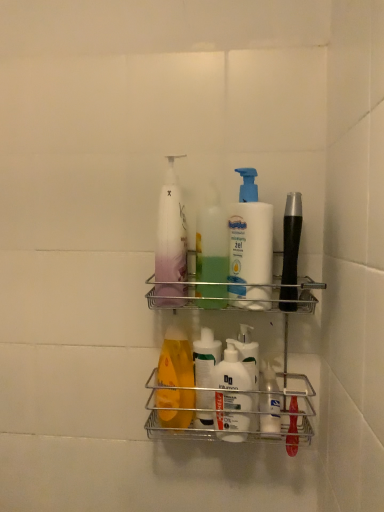
The height and width of the screenshot is (512, 384). I want to click on translucent plastic pump bottle at center, which is the first cleaning product in left-to-right order, so click(170, 241).

Find the location of `metallic silver shelf at center`. metallic silver shelf at center is located at coordinates (225, 394).

In the image, is white matte lotion at center, the 1th cleaning product in the right-to-left sequence, positioned in front of or behind translucent plastic pump bottle at center, which is the first cleaning product in left-to-right order?

In the image, white matte lotion at center, the 1th cleaning product in the right-to-left sequence, appears in front of translucent plastic pump bottle at center, which is the first cleaning product in left-to-right order.

From the image's perspective, is white matte lotion at center, the 1th cleaning product in the right-to-left sequence, located above or below translucent plastic pump bottle at center, which is the third cleaning product from right to left?

Based on their image positions, white matte lotion at center, the 1th cleaning product in the right-to-left sequence, is located beneath translucent plastic pump bottle at center, which is the third cleaning product from right to left.

Can you confirm if white matte lotion at center, which is the 3th cleaning product in left-to-right order, is bigger than translucent plastic pump bottle at center, which is the third cleaning product from right to left?

No, white matte lotion at center, which is the 3th cleaning product in left-to-right order, is not bigger than translucent plastic pump bottle at center, which is the third cleaning product from right to left.

Consider the image. Is white matte lotion at center, the 1th cleaning product in the right-to-left sequence, in contact with translucent plastic pump bottle at center, which is the third cleaning product from right to left?

No.

Is translucent plastic pump bottle at center, which is the first cleaning product in left-to-right order, behind translucent plastic bottle at center, the second cleaning product in the left-to-right sequence?

Yes, translucent plastic pump bottle at center, which is the first cleaning product in left-to-right order, is further from the viewer.

In terms of size, does translucent plastic pump bottle at center, which is the third cleaning product from right to left, appear bigger or smaller than translucent plastic bottle at center, positioned as the second cleaning product in right-to-left order?

translucent plastic pump bottle at center, which is the third cleaning product from right to left, is bigger than translucent plastic bottle at center, positioned as the second cleaning product in right-to-left order.

From a real-world perspective, relative to translucent plastic bottle at center, the second cleaning product in the left-to-right sequence, is translucent plastic pump bottle at center, which is the first cleaning product in left-to-right order, vertically above or below?

Clearly, from a real-world perspective, translucent plastic pump bottle at center, which is the first cleaning product in left-to-right order, is above translucent plastic bottle at center, the second cleaning product in the left-to-right sequence.

Could you tell me if translucent plastic pump bottle at center, which is the first cleaning product in left-to-right order, is turned towards translucent plastic bottle at center, positioned as the second cleaning product in right-to-left order?

No, translucent plastic pump bottle at center, which is the first cleaning product in left-to-right order, does not turn towards translucent plastic bottle at center, positioned as the second cleaning product in right-to-left order.

Can you confirm if translucent plastic pump bottle at center, which is the first cleaning product in left-to-right order, is smaller than metallic silver shelf at center?

Yes.

From the image's perspective, is translucent plastic pump bottle at center, which is the third cleaning product from right to left, on top of metallic silver shelf at center?

Yes, from the image's perspective, translucent plastic pump bottle at center, which is the third cleaning product from right to left, is over metallic silver shelf at center.

Find the location of a particular element. Image resolution: width=384 pixels, height=512 pixels. shelf in front of the translucent plastic pump bottle at center, which is the third cleaning product from right to left is located at coordinates (225, 394).

The height and width of the screenshot is (512, 384). In order to click on cleaning product in front of the translucent plastic bottle at center, positioned as the second cleaning product in right-to-left order in this screenshot , I will do `click(250, 242)`.

Which object is thinner, white matte lotion at center, which is the 3th cleaning product in left-to-right order, or translucent plastic bottle at center, positioned as the second cleaning product in right-to-left order?

With smaller width is white matte lotion at center, which is the 3th cleaning product in left-to-right order.

Considering the sizes of objects white matte lotion at center, the 1th cleaning product in the right-to-left sequence, and translucent plastic bottle at center, the second cleaning product in the left-to-right sequence, in the image provided, who is taller, white matte lotion at center, the 1th cleaning product in the right-to-left sequence, or translucent plastic bottle at center, the second cleaning product in the left-to-right sequence,?

Standing taller between the two is translucent plastic bottle at center, the second cleaning product in the left-to-right sequence.

Is white matte lotion at center, the 1th cleaning product in the right-to-left sequence, aimed at translucent plastic bottle at center, positioned as the second cleaning product in right-to-left order?

No, white matte lotion at center, the 1th cleaning product in the right-to-left sequence, is not turned towards translucent plastic bottle at center, positioned as the second cleaning product in right-to-left order.

From the image's perspective, is translucent plastic bottle at center, positioned as the second cleaning product in right-to-left order, under white matte lotion at center, which is the 3th cleaning product in left-to-right order?

No, from the image's perspective, translucent plastic bottle at center, positioned as the second cleaning product in right-to-left order, is not below white matte lotion at center, which is the 3th cleaning product in left-to-right order.

Considering the relative positions of translucent plastic bottle at center, positioned as the second cleaning product in right-to-left order, and white matte lotion at center, which is the 3th cleaning product in left-to-right order, in the image provided, is translucent plastic bottle at center, positioned as the second cleaning product in right-to-left order, to the right of white matte lotion at center, which is the 3th cleaning product in left-to-right order, from the viewer's perspective?

In fact, translucent plastic bottle at center, positioned as the second cleaning product in right-to-left order, is to the left of white matte lotion at center, which is the 3th cleaning product in left-to-right order.

Can you tell me how much translucent plastic bottle at center, the second cleaning product in the left-to-right sequence, and white matte lotion at center, which is the 3th cleaning product in left-to-right order, differ in facing direction?

translucent plastic bottle at center, the second cleaning product in the left-to-right sequence, and white matte lotion at center, which is the 3th cleaning product in left-to-right order, are facing 0.000718 degrees away from each other.

I want to click on cleaning product that appears on the right of translucent plastic bottle at center, the second cleaning product in the left-to-right sequence, so click(250, 242).

Where is `the 2nd cleaning product in front of the translucent plastic pump bottle at center, which is the third cleaning product from right to left, counting from the anchor's position`? the 2nd cleaning product in front of the translucent plastic pump bottle at center, which is the third cleaning product from right to left, counting from the anchor's position is located at coordinates (250, 242).

Which is behind, point (183, 214) or point (257, 219)?

The point (183, 214) is more distant.

Would you say translucent plastic pump bottle at center, which is the third cleaning product from right to left, is inside or outside white matte lotion at center, the 1th cleaning product in the right-to-left sequence?

translucent plastic pump bottle at center, which is the third cleaning product from right to left, is located beyond the bounds of white matte lotion at center, the 1th cleaning product in the right-to-left sequence.

From the image's perspective, who appears lower, translucent plastic pump bottle at center, which is the third cleaning product from right to left, or white matte lotion at center, the 1th cleaning product in the right-to-left sequence?

white matte lotion at center, the 1th cleaning product in the right-to-left sequence, from the image's perspective.

Identify the location of shelf below the white matte lotion at center, the 1th cleaning product in the right-to-left sequence (from the image's perspective). The width and height of the screenshot is (384, 512). (225, 394).

Is point (251, 305) positioned before point (250, 371)?

Yes, point (251, 305) is closer to viewer.

Would you say white matte lotion at center, which is the 3th cleaning product in left-to-right order, is to the left or to the right of metallic silver shelf at center in the picture?

white matte lotion at center, which is the 3th cleaning product in left-to-right order, is positioned on metallic silver shelf at center's right side.

From a real-world perspective, is white matte lotion at center, the 1th cleaning product in the right-to-left sequence, physically below metallic silver shelf at center?

Incorrect, from a real-world perspective, white matte lotion at center, the 1th cleaning product in the right-to-left sequence, is higher than metallic silver shelf at center.

Find the location of a particular element. cleaning product that is the 2nd one when counting leftward from the white matte lotion at center, which is the 3th cleaning product in left-to-right order is located at coordinates (170, 241).

The width and height of the screenshot is (384, 512). In order to click on cleaning product that is the 1st one when counting downward from the translucent plastic pump bottle at center, which is the first cleaning product in left-to-right order (from the image's perspective) in this screenshot , I will do `click(212, 241)`.

From the image, which object appears to be farther from translucent plastic pump bottle at center, which is the first cleaning product in left-to-right order, translucent plastic bottle at center, positioned as the second cleaning product in right-to-left order, or metallic silver shelf at center?

Based on the image, metallic silver shelf at center appears to be further to translucent plastic pump bottle at center, which is the first cleaning product in left-to-right order.

Based on their spatial positions, is white matte lotion at center, which is the 3th cleaning product in left-to-right order, or translucent plastic pump bottle at center, which is the third cleaning product from right to left, further from translucent plastic bottle at center, positioned as the second cleaning product in right-to-left order?

Based on the image, translucent plastic pump bottle at center, which is the third cleaning product from right to left, appears to be further to translucent plastic bottle at center, positioned as the second cleaning product in right-to-left order.

Looking at the image, which one is located closer to white matte lotion at center, the 1th cleaning product in the right-to-left sequence, metallic silver shelf at center or translucent plastic bottle at center, positioned as the second cleaning product in right-to-left order?

Among the two, translucent plastic bottle at center, positioned as the second cleaning product in right-to-left order, is located nearer to white matte lotion at center, the 1th cleaning product in the right-to-left sequence.

Which object lies nearer to the anchor point metallic silver shelf at center, white matte lotion at center, which is the 3th cleaning product in left-to-right order, or translucent plastic bottle at center, positioned as the second cleaning product in right-to-left order?

white matte lotion at center, which is the 3th cleaning product in left-to-right order, is closer to metallic silver shelf at center.

Considering their positions, is white matte lotion at center, which is the 3th cleaning product in left-to-right order, positioned further to translucent plastic pump bottle at center, which is the third cleaning product from right to left, than metallic silver shelf at center?

metallic silver shelf at center is further to translucent plastic pump bottle at center, which is the third cleaning product from right to left.

In the scene shown: From the image, which object appears to be farther from metallic silver shelf at center, translucent plastic bottle at center, positioned as the second cleaning product in right-to-left order, or white matte lotion at center, the 1th cleaning product in the right-to-left sequence?

translucent plastic bottle at center, positioned as the second cleaning product in right-to-left order, is further to metallic silver shelf at center.

Considering their positions, is translucent plastic bottle at center, the second cleaning product in the left-to-right sequence, positioned closer to white matte lotion at center, the 1th cleaning product in the right-to-left sequence, than translucent plastic pump bottle at center, which is the third cleaning product from right to left?

translucent plastic bottle at center, the second cleaning product in the left-to-right sequence.

When comparing their distances from translucent plastic pump bottle at center, which is the third cleaning product from right to left, does translucent plastic bottle at center, positioned as the second cleaning product in right-to-left order, or white matte lotion at center, which is the 3th cleaning product in left-to-right order, seem closer?

Among the two, translucent plastic bottle at center, positioned as the second cleaning product in right-to-left order, is located nearer to translucent plastic pump bottle at center, which is the third cleaning product from right to left.

Locate an element on the screen. cleaning product that lies between translucent plastic bottle at center, the second cleaning product in the left-to-right sequence, and metallic silver shelf at center from top to bottom is located at coordinates (250, 242).

Where is `cleaning product between translucent plastic pump bottle at center, which is the third cleaning product from right to left, and white matte lotion at center, which is the 3th cleaning product in left-to-right order, from left to right`? Image resolution: width=384 pixels, height=512 pixels. cleaning product between translucent plastic pump bottle at center, which is the third cleaning product from right to left, and white matte lotion at center, which is the 3th cleaning product in left-to-right order, from left to right is located at coordinates (212, 241).